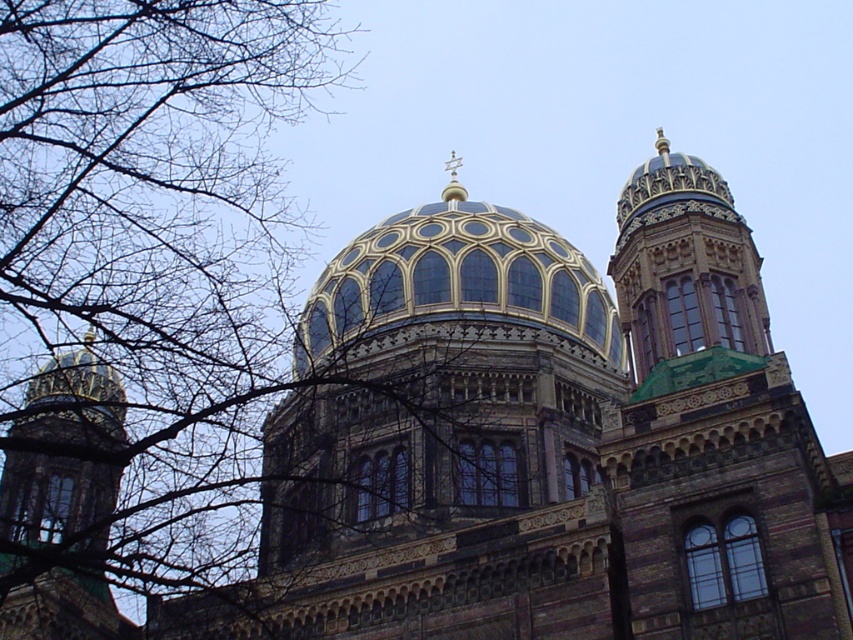
Question: Which of the following is the closest to the observer?

Choices:
 (A) gold-gilded dome at center
 (B) bare branches at upper left

Answer: (A)

Question: Which point is farther to the camera?

Choices:
 (A) blue glass dome at center
 (B) bare branches at upper left
 (C) shiny gold dome at upper right
 (D) gold-gilded dome at center

Answer: (A)

Question: Does bare branches at upper left have a greater width compared to gold-gilded dome at center?

Choices:
 (A) yes
 (B) no

Answer: (A)

Question: Can you confirm if bare branches at upper left is positioned to the right of shiny gold dome at upper right?

Choices:
 (A) no
 (B) yes

Answer: (A)

Question: Among these objects, which one is nearest to the camera?

Choices:
 (A) shiny gold dome at upper right
 (B) bare branches at upper left
 (C) blue glass dome at center
 (D) gold-gilded dome at center

Answer: (D)

Question: Is blue glass dome at center thinner than gold-gilded dome at center?

Choices:
 (A) no
 (B) yes

Answer: (A)